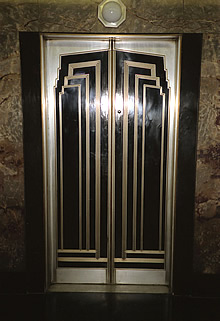
Image resolution: width=220 pixels, height=321 pixels. What are the coordinates of `doorway` in the screenshot? It's located at (91, 275), (132, 278).